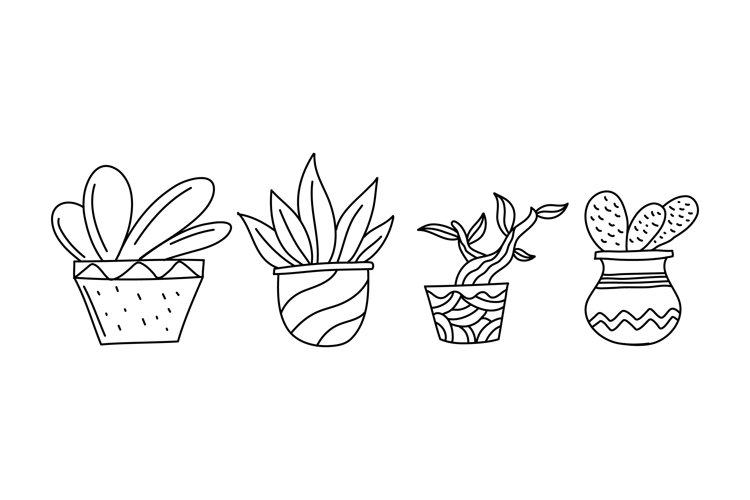
Where is `vases`? Image resolution: width=750 pixels, height=500 pixels. vases is located at coordinates (142, 284), (334, 324), (456, 316), (643, 270).